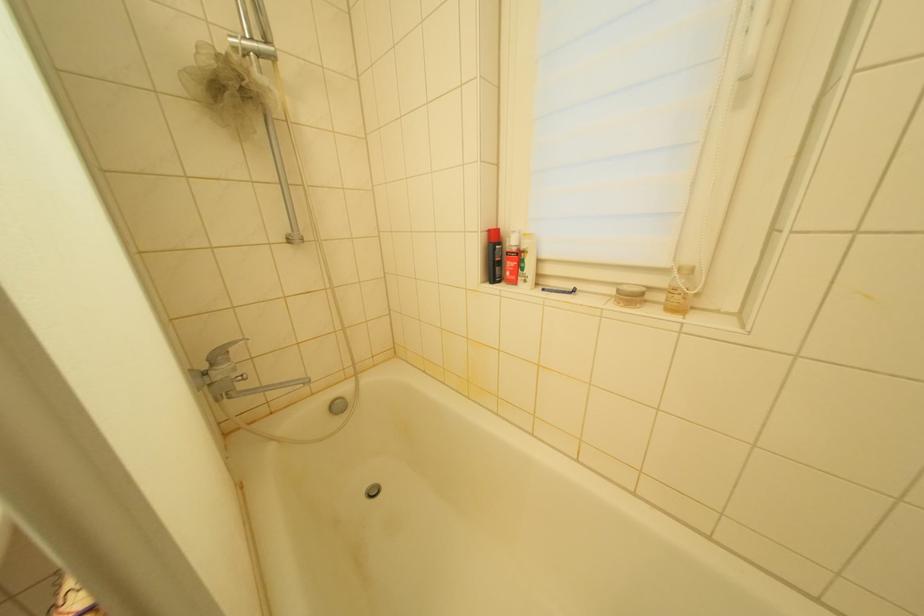
The height and width of the screenshot is (616, 924). Identify the location of beige shower loofah. (226, 87).